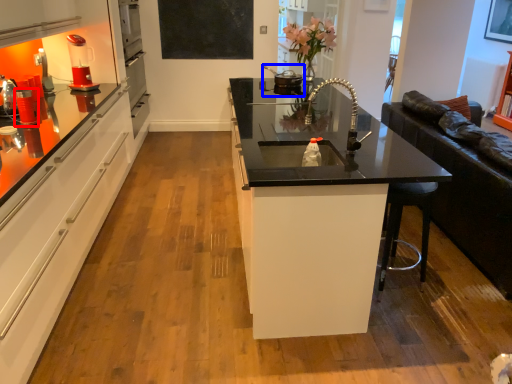
Question: Which object is closer to the camera taking this photo, appliance (highlighted by a red box) or appliance (highlighted by a blue box)?

Choices:
 (A) appliance
 (B) appliance

Answer: (A)